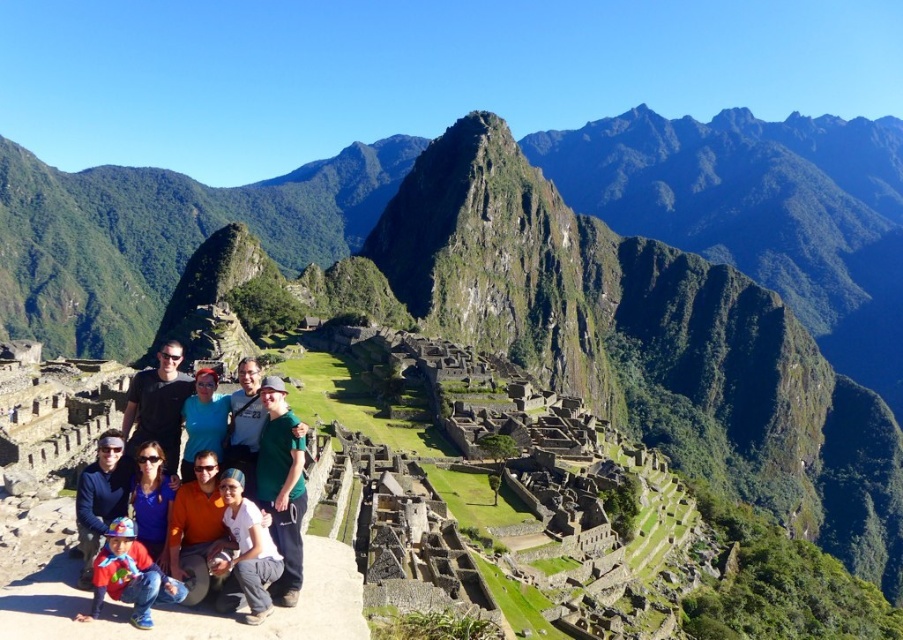
Measure the distance between multicolored clothing at center and camera.

They are 67.41 feet apart.

Does multicolored clothing at center appear on the left side of matte red shirt at lower left?

Indeed, multicolored clothing at center is positioned on the left side of matte red shirt at lower left.

Between point (163, 410) and point (92, 593), which one is positioned behind?

The point (163, 410) is more distant.

You are a GUI agent. You are given a task and a screenshot of the screen. Output one action in this format:
    pyautogui.click(x=<x>, y=<y>)
    Task: Click on the multicolored clothing at center
    The height and width of the screenshot is (640, 903).
    Given the screenshot: What is the action you would take?
    pyautogui.click(x=166, y=412)

Looking at this image, is blue cotton shirt at lower left above matte blue shirt at center?

Incorrect, blue cotton shirt at lower left is not positioned above matte blue shirt at center.

Between blue cotton shirt at lower left and matte blue shirt at center, which one has less height?

With less height is matte blue shirt at center.

Is point (103, 442) farther from camera compared to point (224, 406)?

That is False.

Where is `blue cotton shirt at lower left`? The image size is (903, 640). blue cotton shirt at lower left is located at coordinates (100, 497).

Can you confirm if white cotton shirt at lower center is smaller than blue cotton shirt at lower left?

Yes.

Which is behind, point (250, 577) or point (110, 500)?

Positioned behind is point (110, 500).

At what (x,y) coordinates should I click in order to perform the action: click on white cotton shirt at lower center. Please return your answer as a coordinate pair (x, y). Looking at the image, I should click on (245, 552).